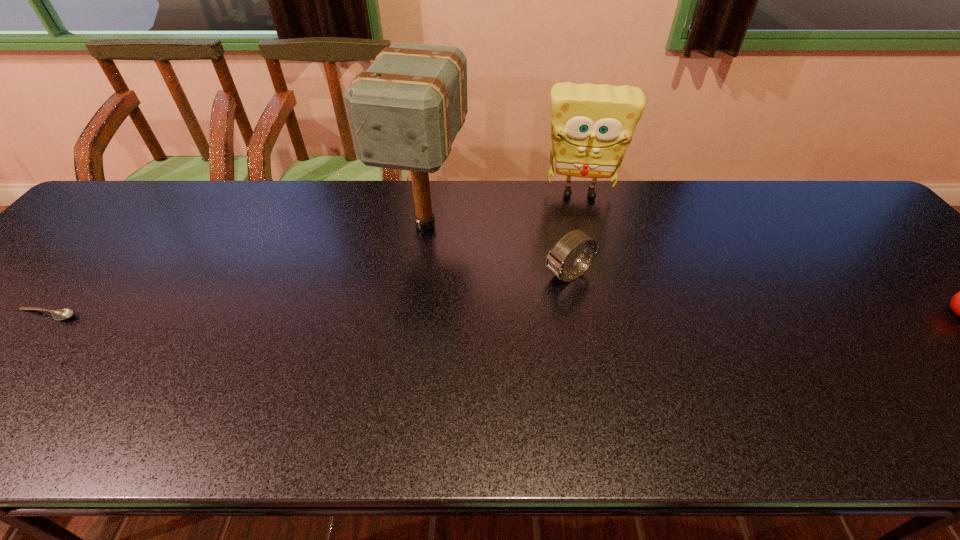
Locate an element on the screen. soupspoon is located at coordinates (62, 314).

Find the location of a particular element. The width and height of the screenshot is (960, 540). the leftmost object is located at coordinates (62, 314).

Where is `the tallest object`? The image size is (960, 540). the tallest object is located at coordinates (405, 110).

What are the coordinates of `mallet` in the screenshot? It's located at (405, 110).

You are a GUI agent. You are given a task and a screenshot of the screen. Output one action in this format:
    pyautogui.click(x=<x>, y=<y>)
    Task: Click on the watch
    
    Given the screenshot: What is the action you would take?
    (x=555, y=260)

Identify the location of sponge. (592, 125).

The height and width of the screenshot is (540, 960). I want to click on vacant space located on the back of the leftmost object, so click(x=93, y=262).

At what (x,y) coordinates should I click in order to perform the action: click on free space located on the striking surface of the mallet. Please return your answer as a coordinate pair (x, y). The width and height of the screenshot is (960, 540). Looking at the image, I should click on (397, 295).

Locate an element on the screen. The height and width of the screenshot is (540, 960). vacant space situated on the striking surface of the mallet is located at coordinates (400, 289).

Find the location of a particular element. The image size is (960, 540). free spot located 0.160m on the striking surface of the mallet is located at coordinates (391, 311).